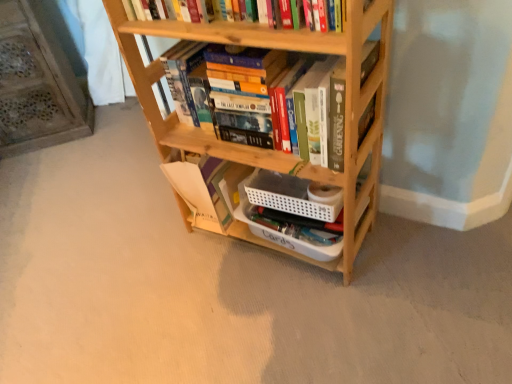
This screenshot has height=384, width=512. Find the location of `vacant space that's between wooden bookshelf at left and natural wood bookcase at center`. vacant space that's between wooden bookshelf at left and natural wood bookcase at center is located at coordinates (103, 166).